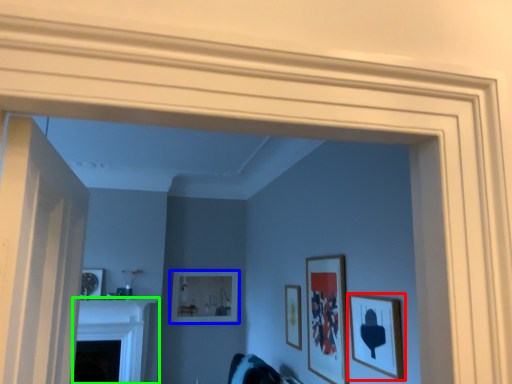
Question: Which is nearer to the picture frame (highlighted by a red box)? picture frame (highlighted by a blue box) or fireplace (highlighted by a green box).

Choices:
 (A) picture frame
 (B) fireplace

Answer: (A)